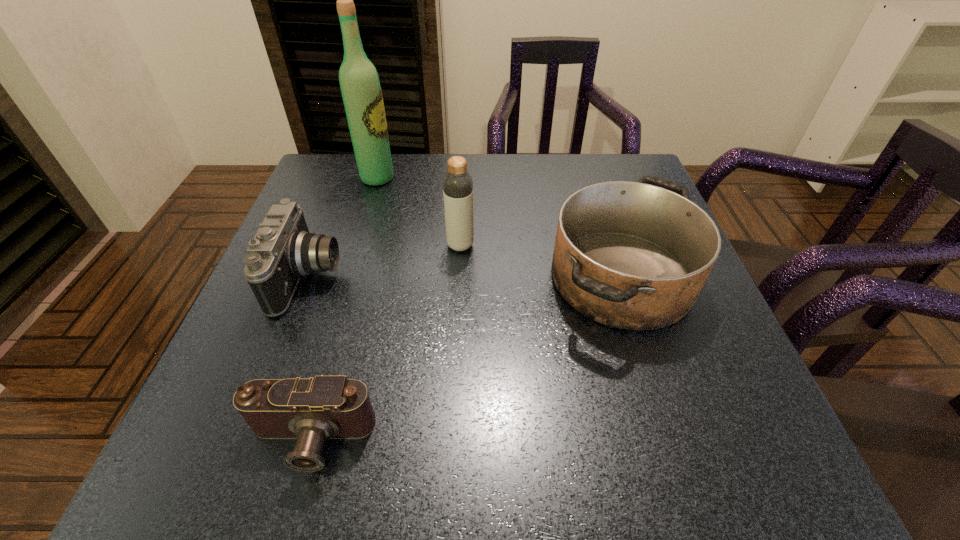
At what (x,y) coordinates should I click in order to perform the action: click on free spot located 0.270m on the front-facing side of the taller camera. Please return your answer as a coordinate pair (x, y). This screenshot has height=540, width=960. Looking at the image, I should click on (471, 277).

The height and width of the screenshot is (540, 960). In order to click on vacant region located on the left of the rightmost object in this screenshot , I will do `click(488, 278)`.

The width and height of the screenshot is (960, 540). Find the location of `object that is at the far edge`. object that is at the far edge is located at coordinates (361, 90).

At what (x,y) coordinates should I click in order to perform the action: click on object present at the near edge. Please return your answer as a coordinate pair (x, y). The image size is (960, 540). Looking at the image, I should click on (313, 410).

What are the coordinates of `wine bottle that is at the left edge` in the screenshot? It's located at (361, 90).

Where is `object that is positioned at the right edge`? object that is positioned at the right edge is located at coordinates (631, 255).

Find the location of a particular element. This screenshot has height=540, width=960. object located at the far left corner is located at coordinates (361, 90).

Identify the location of object located in the near left corner section of the desktop. The height and width of the screenshot is (540, 960). (313, 410).

Where is `vacant region at the far edge of the desktop`? The width and height of the screenshot is (960, 540). vacant region at the far edge of the desktop is located at coordinates (566, 155).

You are a GUI agent. You are given a task and a screenshot of the screen. Output one action in this format:
    pyautogui.click(x=<x>, y=<y>)
    Task: Click on the vacant space at the near edge of the desktop
    This screenshot has width=960, height=540.
    Given the screenshot: What is the action you would take?
    pyautogui.click(x=448, y=455)